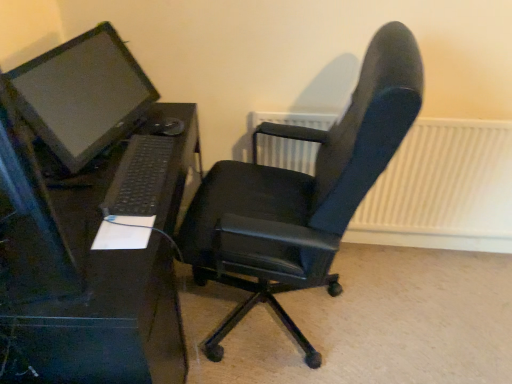
You are a GUI agent. You are given a task and a screenshot of the screen. Output one action in this format:
    pyautogui.click(x=<x>, y=<y>)
    Task: Click on the vacant area that is in front of white textured radiator at upper right
    This screenshot has height=384, width=512.
    Given the screenshot: What is the action you would take?
    pyautogui.click(x=373, y=319)